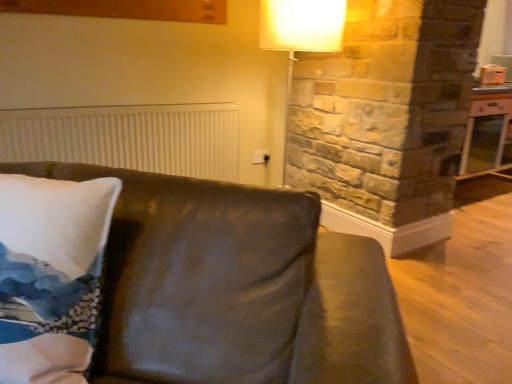
Question: Can you confirm if leather couch at center is positioned to the left of wooden table at right?

Choices:
 (A) yes
 (B) no

Answer: (A)

Question: From the image's perspective, would you say leather couch at center is shown under wooden table at right?

Choices:
 (A) yes
 (B) no

Answer: (A)

Question: Is leather couch at center positioned with its back to wooden table at right?

Choices:
 (A) yes
 (B) no

Answer: (A)

Question: Is leather couch at center wider than wooden table at right?

Choices:
 (A) yes
 (B) no

Answer: (A)

Question: Is leather couch at center outside wooden table at right?

Choices:
 (A) no
 (B) yes

Answer: (B)

Question: Relative to white ribbed radiator at upper left, is wooden table at right in front or behind?

Choices:
 (A) behind
 (B) front

Answer: (A)

Question: Considering the positions of wooden table at right and white ribbed radiator at upper left in the image, is wooden table at right wider or thinner than white ribbed radiator at upper left?

Choices:
 (A) thin
 (B) wide

Answer: (B)

Question: Based on their positions, is wooden table at right located to the left or right of white ribbed radiator at upper left?

Choices:
 (A) left
 (B) right

Answer: (B)

Question: Does point (501, 152) appear closer or farther from the camera than point (164, 119)?

Choices:
 (A) closer
 (B) farther

Answer: (B)

Question: From a real-world perspective, is leather couch at center above or below wooden table at right?

Choices:
 (A) above
 (B) below

Answer: (B)

Question: Considering the positions of leather couch at center and wooden table at right in the image, is leather couch at center taller or shorter than wooden table at right?

Choices:
 (A) short
 (B) tall

Answer: (B)

Question: Choose the correct answer: Is leather couch at center inside wooden table at right or outside it?

Choices:
 (A) inside
 (B) outside

Answer: (B)

Question: From the image's perspective, is leather couch at center located above or below wooden table at right?

Choices:
 (A) below
 (B) above

Answer: (A)

Question: Considering their positions, is white ribbed radiator at upper left located in front of or behind wooden table at right?

Choices:
 (A) front
 (B) behind

Answer: (A)

Question: Is white ribbed radiator at upper left situated inside wooden table at right or outside?

Choices:
 (A) inside
 (B) outside

Answer: (B)